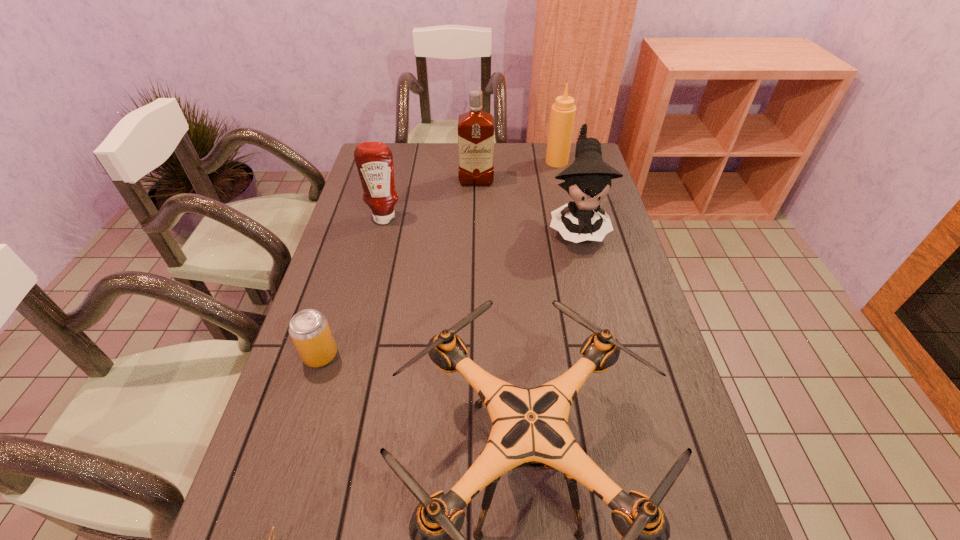
In order to click on vacant space at the far left corner in this screenshot , I will do `click(403, 154)`.

Where is `free region at the far right corner`? This screenshot has width=960, height=540. free region at the far right corner is located at coordinates (559, 168).

Locate an element on the screen. Image resolution: width=960 pixels, height=540 pixels. empty location between the second shortest object and the doll is located at coordinates (448, 291).

At what (x,y) coordinates should I click in order to perform the action: click on free point between the liquor and the farthest object. Please return your answer as a coordinate pair (x, y). Looking at the image, I should click on (516, 172).

What are the coordinates of `vacant space that's between the liquor and the farther condiment` in the screenshot? It's located at (516, 172).

Locate an element on the screen. The image size is (960, 540). empty location between the liquor and the nearer condiment is located at coordinates 430,200.

Identify which object is located as the fourth nearest to the sixth nearest object. Please provide its 2D coordinates. Your answer should be formatted as a tuple, i.e. [(x, y)], where the tuple contains the x and y coordinates of a point satisfying the conditions above.

[(309, 329)]

I want to click on object that is the fourth closest to the shortest object, so click(x=588, y=180).